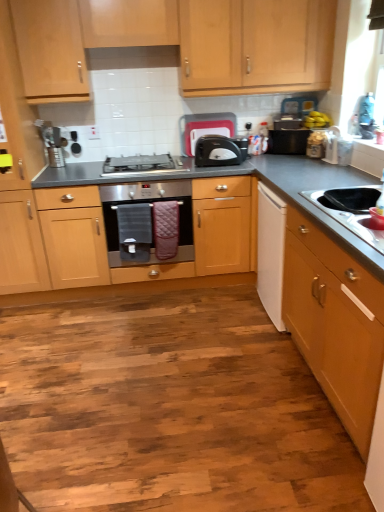
Locate an element on the screen. This screenshot has height=512, width=384. free space in front of brushed metal toaster at center, which appears as the fourth appliance when viewed from the right is located at coordinates (65, 167).